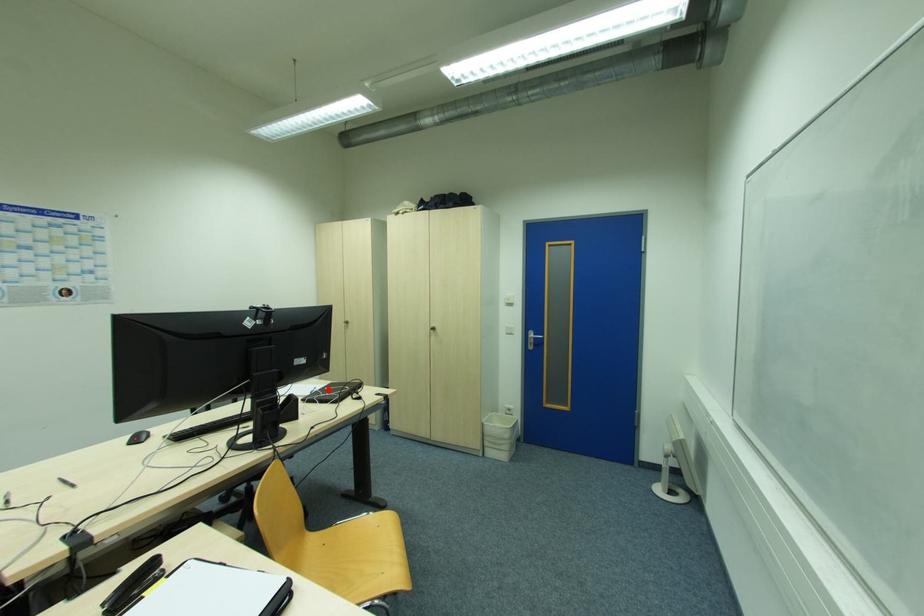
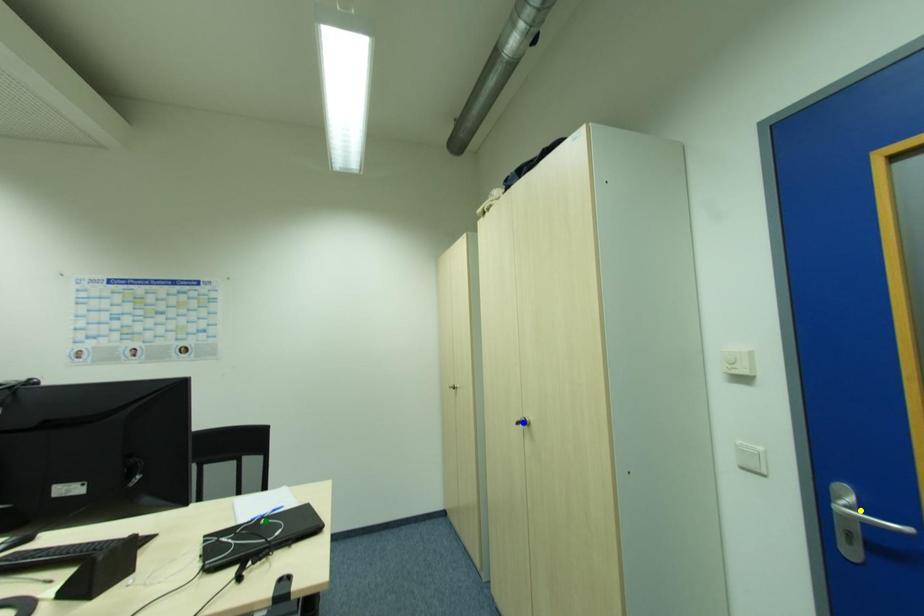
Question: I am providing you with two images of the same scene from different viewpoints. A red point is marked on the first image. You are given multiple points on the second image. Which point in image 2 is actually the same real-world point as the red point in image 1?

Choices:
 (A) blue point
 (B) yellow point
 (C) green point

Answer: (C)